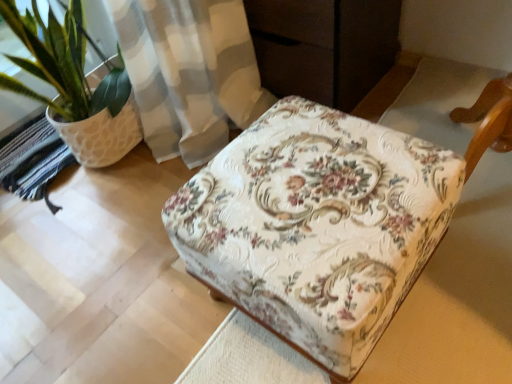
Describe the element at coordinates (317, 226) in the screenshot. I see `floral fabric ottoman at center` at that location.

Find the location of `floral fabric ottoman at center`. floral fabric ottoman at center is located at coordinates (317, 226).

Identify the location of green leafy plant in textured pot at left. The height and width of the screenshot is (384, 512). (75, 86).

The width and height of the screenshot is (512, 384). Describe the element at coordinates (75, 86) in the screenshot. I see `green leafy plant in textured pot at left` at that location.

The height and width of the screenshot is (384, 512). What are the coordinates of `floral fabric ottoman at center` in the screenshot? It's located at (x=317, y=226).

Considering the relative positions of floral fabric ottoman at center and green leafy plant in textured pot at left in the image provided, is floral fabric ottoman at center to the left or to the right of green leafy plant in textured pot at left?

In the image, floral fabric ottoman at center appears on the right side of green leafy plant in textured pot at left.

Is floral fabric ottoman at center in front of or behind green leafy plant in textured pot at left in the image?

Visually, floral fabric ottoman at center is located in front of green leafy plant in textured pot at left.

Between point (223, 250) and point (47, 106), which one is positioned in front?

The point (223, 250) is more forward.

Looking at this image, from the image's perspective, relative to green leafy plant in textured pot at left, is floral fabric ottoman at center above or below?

Clearly, from the image's perspective, floral fabric ottoman at center is below green leafy plant in textured pot at left.

From a real-world perspective, is floral fabric ottoman at center positioned above or below green leafy plant in textured pot at left?

In terms of real-world spatial position, floral fabric ottoman at center is below green leafy plant in textured pot at left.

Looking at this image, looking at their sizes, would you say floral fabric ottoman at center is wider or thinner than green leafy plant in textured pot at left?

In the image, floral fabric ottoman at center appears to be wider than green leafy plant in textured pot at left.

Does floral fabric ottoman at center have a lesser height compared to green leafy plant in textured pot at left?

Indeed, floral fabric ottoman at center has a lesser height compared to green leafy plant in textured pot at left.

Is floral fabric ottoman at center bigger or smaller than green leafy plant in textured pot at left?

In the image, floral fabric ottoman at center appears to be smaller than green leafy plant in textured pot at left.

Consider the image. Is floral fabric ottoman at center inside or outside of green leafy plant in textured pot at left?

floral fabric ottoman at center lies outside green leafy plant in textured pot at left.

Are floral fabric ottoman at center and green leafy plant in textured pot at left far apart?

floral fabric ottoman at center is actually quite close to green leafy plant in textured pot at left.

Is floral fabric ottoman at center oriented towards green leafy plant in textured pot at left?

No, floral fabric ottoman at center is not aimed at green leafy plant in textured pot at left.

Consider the image. What's the angular difference between floral fabric ottoman at center and green leafy plant in textured pot at left's facing directions?

92.5 degrees.

How much distance is there between floral fabric ottoman at center and green leafy plant in textured pot at left?

floral fabric ottoman at center and green leafy plant in textured pot at left are 26.71 inches apart.

Where is `houseplant on the left of floral fabric ottoman at center`? houseplant on the left of floral fabric ottoman at center is located at coordinates (75, 86).

Does green leafy plant in textured pot at left appear on the left side of floral fabric ottoman at center?

Yes.

Is the position of green leafy plant in textured pot at left more distant than that of floral fabric ottoman at center?

Yes.

Is point (96, 139) closer or farther from the camera than point (329, 239)?

Point (96, 139) appears to be farther away from the viewer than point (329, 239).

From the image's perspective, relative to floral fabric ottoman at center, is green leafy plant in textured pot at left above or below?

green leafy plant in textured pot at left is situated higher than floral fabric ottoman at center in the image.

From a real-world perspective, is green leafy plant in textured pot at left located higher than floral fabric ottoman at center?

Yes, from a real-world perspective, green leafy plant in textured pot at left is on top of floral fabric ottoman at center.

Which object is wider, green leafy plant in textured pot at left or floral fabric ottoman at center?

floral fabric ottoman at center is wider.

Between green leafy plant in textured pot at left and floral fabric ottoman at center, which one has more height?

Standing taller between the two is green leafy plant in textured pot at left.

Who is bigger, green leafy plant in textured pot at left or floral fabric ottoman at center?

Bigger between the two is green leafy plant in textured pot at left.

Is green leafy plant in textured pot at left completely or partially outside of floral fabric ottoman at center?

Yes, green leafy plant in textured pot at left is located beyond the bounds of floral fabric ottoman at center.

Based on the photo, is green leafy plant in textured pot at left far from floral fabric ottoman at center?

No.

Could you tell me if green leafy plant in textured pot at left is turned towards floral fabric ottoman at center?

Yes, green leafy plant in textured pot at left is oriented towards floral fabric ottoman at center.

How many degrees apart are the facing directions of green leafy plant in textured pot at left and floral fabric ottoman at center?

green leafy plant in textured pot at left and floral fabric ottoman at center are facing 92.5 degrees away from each other.

You are a GUI agent. You are given a task and a screenshot of the screen. Output one action in this format:
    pyautogui.click(x=<x>, y=<y>)
    Task: Click on the houseplant lying on the left of floral fabric ottoman at center
    Image resolution: width=512 pixels, height=384 pixels.
    Given the screenshot: What is the action you would take?
    tap(75, 86)

The width and height of the screenshot is (512, 384). What are the coordinates of `furniture below the green leafy plant in textured pot at left (from the image's perspective)` in the screenshot? It's located at (317, 226).

The height and width of the screenshot is (384, 512). Find the location of `furniture in front of the green leafy plant in textured pot at left`. furniture in front of the green leafy plant in textured pot at left is located at coordinates (317, 226).